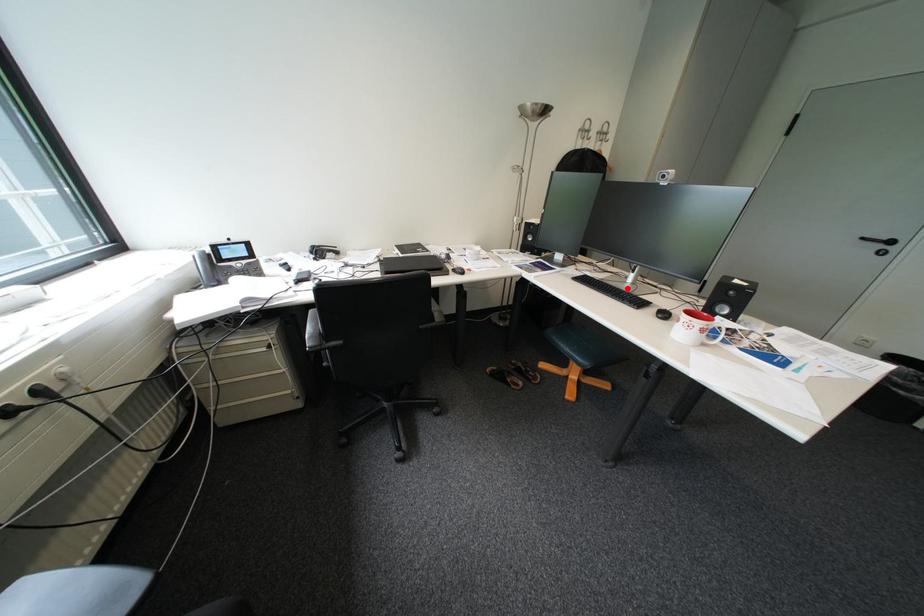
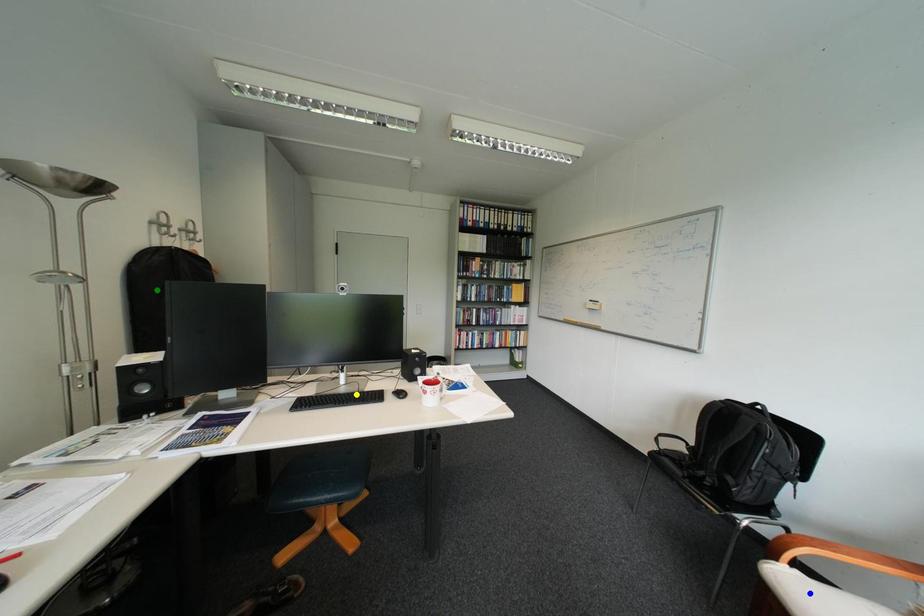
Question: I am providing you with two images of the same scene from different viewpoints. A red point is marked on the first image. You are given multiple points on the second image. Which point in image 2 is actually the same real-world point as the red point in image 1?

Choices:
 (A) green point
 (B) blue point
 (C) yellow point

Answer: (C)